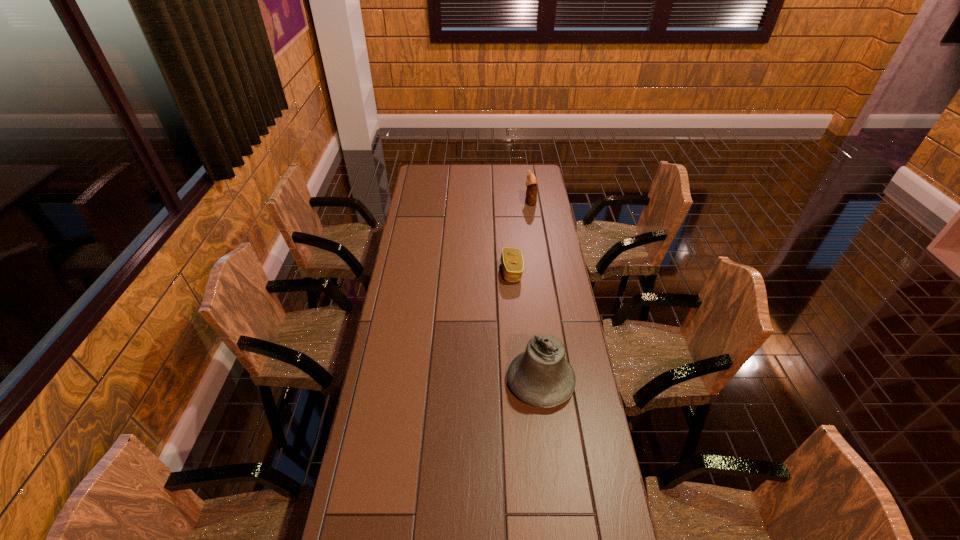
This screenshot has height=540, width=960. Find the location of `bell`. bell is located at coordinates (541, 376).

Locate an element on the screen. the tallest object is located at coordinates pos(541,376).

At what (x,y) coordinates should I click in order to perform the action: click on the farther clutch bag. Please return your answer as a coordinate pair (x, y). Looking at the image, I should click on (531, 182).

Locate an element on the screen. the right clutch bag is located at coordinates (531, 182).

Where is `the shorter clutch bag`? the shorter clutch bag is located at coordinates (512, 261).

Find the location of `the left clutch bag`. the left clutch bag is located at coordinates (512, 261).

Identify the location of free space located on the front of the tallest object. This screenshot has width=960, height=540. (550, 458).

The image size is (960, 540). Identify the location of vacant space located on the open side of the taller clutch bag. (497, 201).

The image size is (960, 540). Identify the location of free spot located on the open side of the taller clutch bag. (490, 201).

The image size is (960, 540). What are the coordinates of `vacant area situated 0.200m on the open side of the taller clutch bag` in the screenshot? It's located at point(486,201).